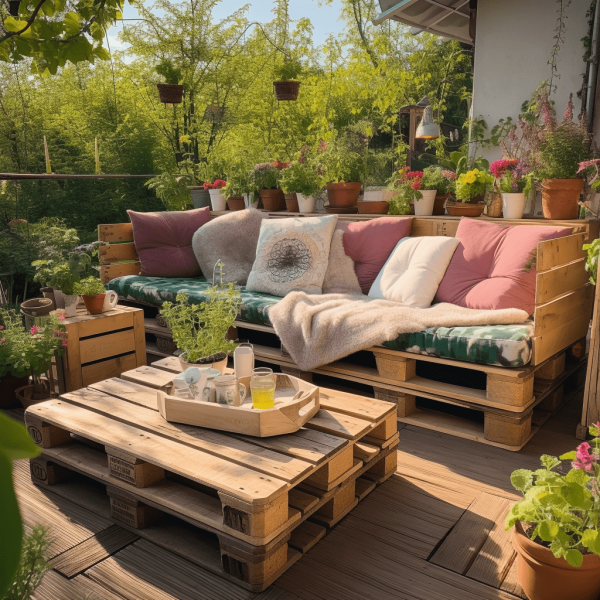
The width and height of the screenshot is (600, 600). In order to click on pink square throw pillow in this screenshot , I will do `click(491, 286)`, `click(371, 246)`, `click(151, 229)`.